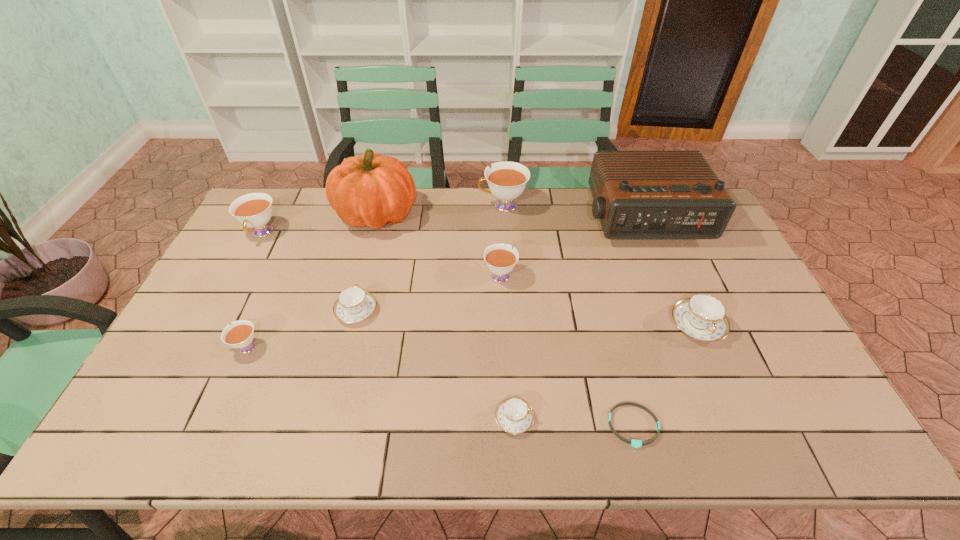
Identify the location of vacant region located on the right of the tallest object. (474, 214).

Locate an element on the screen. This screenshot has height=540, width=960. free region located on the tuning display of the ninth shortest object is located at coordinates (697, 350).

Identify the location of free location located 0.280m on the side of the biggest white teacup with the handle. The height and width of the screenshot is (540, 960). tap(400, 205).

What are the coordinates of `vacant region located on the side of the biggest white teacup with the handle` in the screenshot? It's located at (378, 205).

This screenshot has height=540, width=960. I want to click on vacant region located 0.180m on the side of the biggest white teacup with the handle, so click(x=428, y=205).

The width and height of the screenshot is (960, 540). I want to click on free location located 0.210m on the side of the leftmost teacup with the handle, so click(228, 296).

At what (x,y) coordinates should I click in order to perform the action: click on free space located on the side of the third farthest teacup with the handle. Please return your answer as a coordinate pair (x, y). Looking at the image, I should click on (497, 212).

Image resolution: width=960 pixels, height=540 pixels. What are the coordinates of `vacant space positioned on the side of the third farthest teacup with the handle` in the screenshot? It's located at (499, 246).

Locate an element on the screen. Image resolution: width=960 pixels, height=540 pixels. vacant space located 0.190m on the side of the third farthest teacup with the handle is located at coordinates (498, 223).

At what (x,y) coordinates should I click in order to perform the action: click on vacant space located 0.140m on the side with the handle of the rightmost teacup. Please return your answer as a coordinate pair (x, y). Looking at the image, I should click on (728, 396).